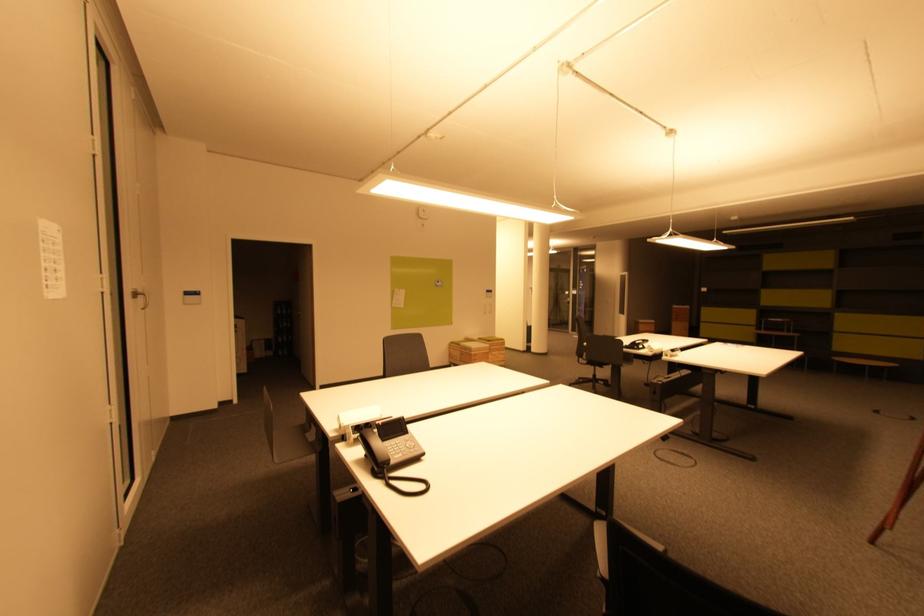
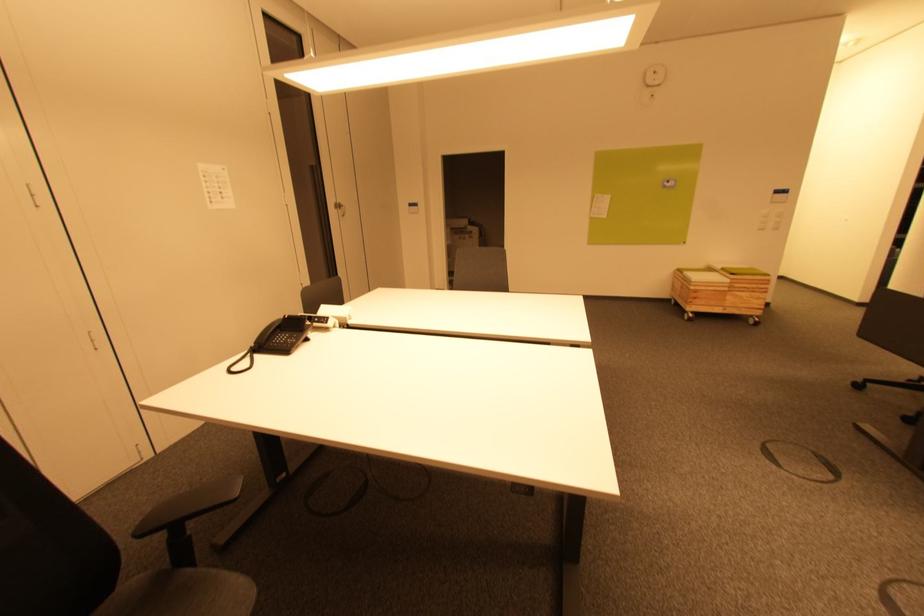
In the second image, find the point that corresponds to point (504, 357) in the first image.

(756, 300)